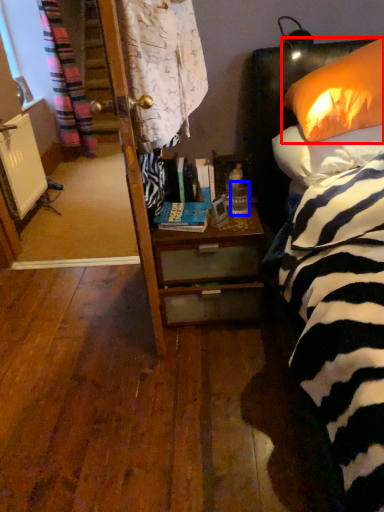
Question: Which of the following is the closest to the observer, pillow (highlighted by a red box) or coffee cup (highlighted by a blue box)?

Choices:
 (A) pillow
 (B) coffee cup

Answer: (A)